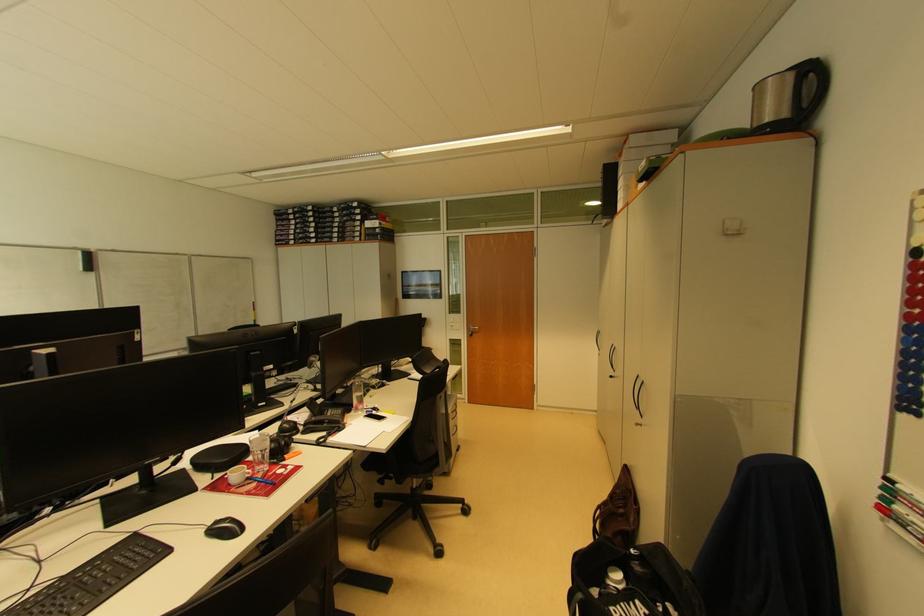
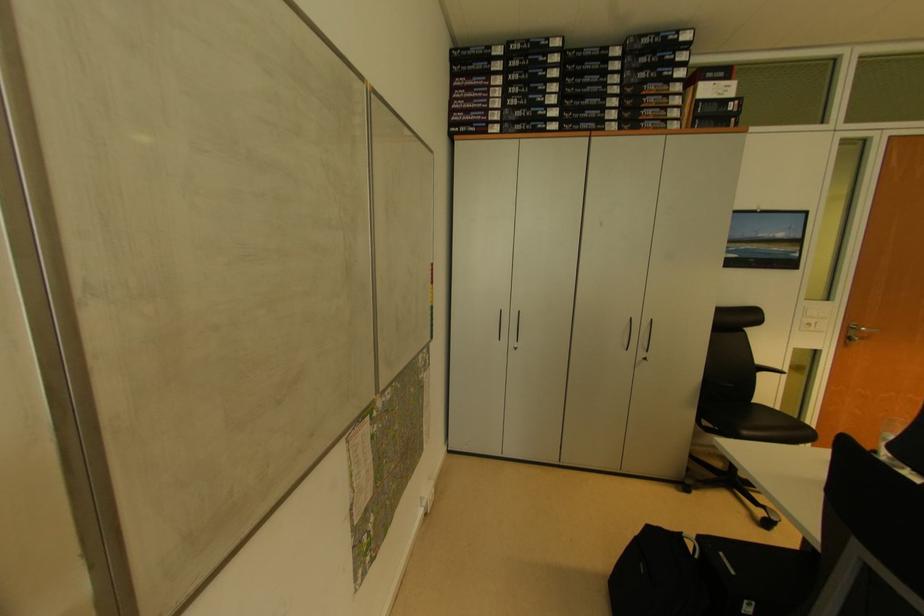
Find the pixel in the second image that matches (348,241) in the first image.

(646, 124)